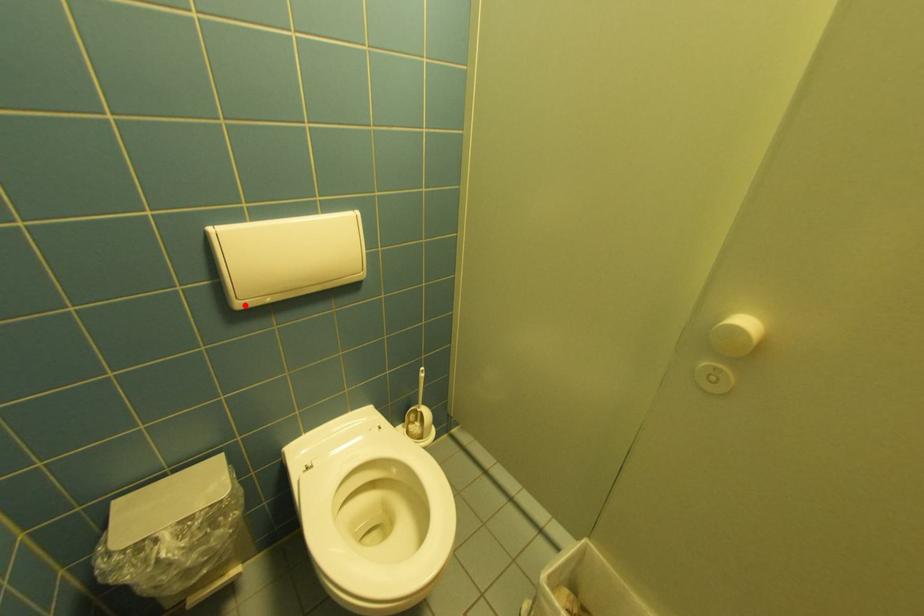
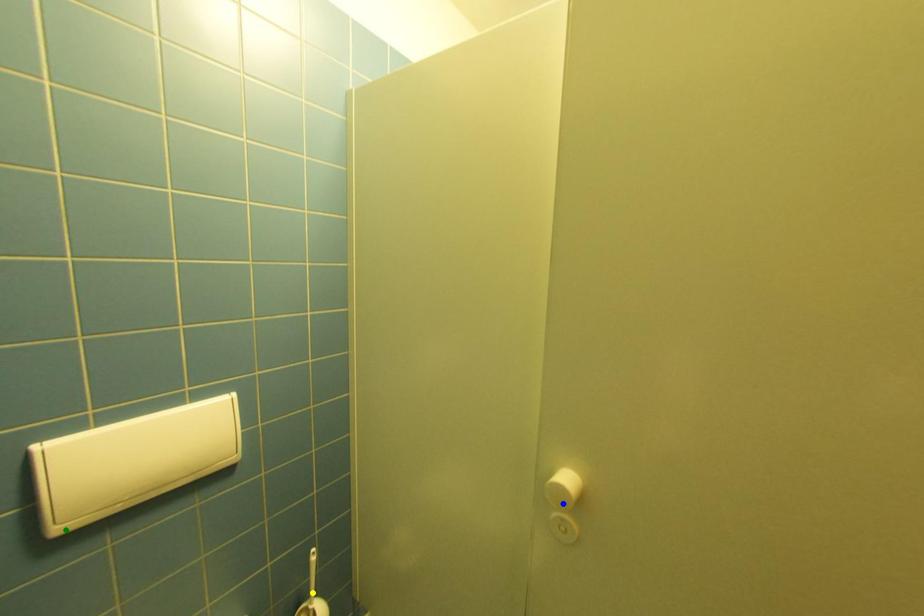
Question: I am providing you with two images of the same scene from different viewpoints. A red point is marked on the first image. You are given multiple points on the second image. In image 2, which mark is for the same physical point as the one in image 1?

Choices:
 (A) green point
 (B) yellow point
 (C) blue point

Answer: (A)